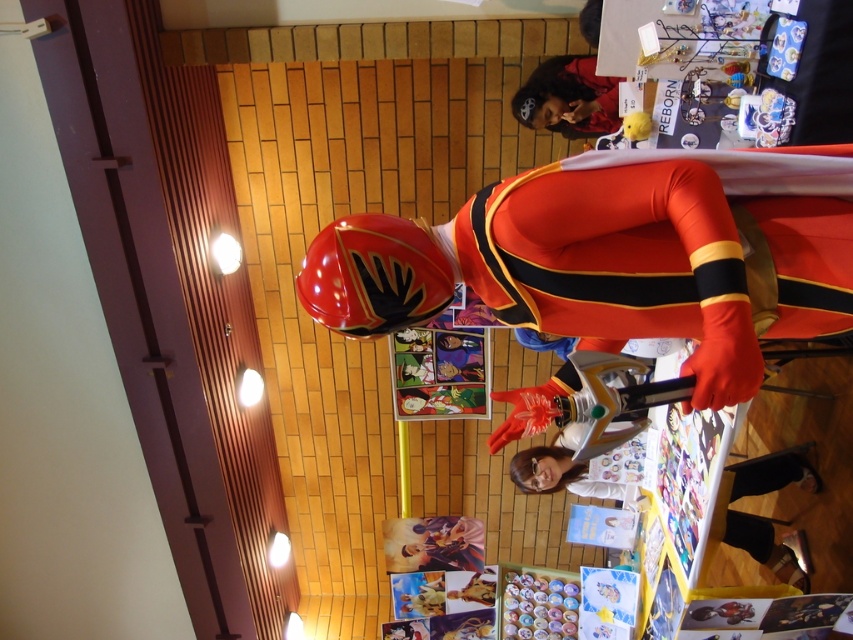
Is point (735, 182) farther from viewer compared to point (556, 102)?

No, it is not.

Which is in front, point (647, 172) or point (564, 97)?

Positioned in front is point (647, 172).

Where is `shiny red helmet at upper center`? This screenshot has height=640, width=853. shiny red helmet at upper center is located at coordinates (618, 257).

Who is higher up, shiny red helmet at upper center or white glossy shirt at lower center?

shiny red helmet at upper center is higher up.

Who is shorter, shiny red helmet at upper center or white glossy shirt at lower center?

white glossy shirt at lower center is shorter.

Between point (544, 227) and point (548, 451), which one is positioned behind?

The point (548, 451) is behind.

Find the location of a particular element. shiny red helmet at upper center is located at coordinates (618, 257).

Between shiny orange spandex at center and white glossy shirt at lower center, which one is positioned higher?

Positioned higher is shiny orange spandex at center.

Can you confirm if shiny orange spandex at center is shorter than white glossy shirt at lower center?

Correct, shiny orange spandex at center is not as tall as white glossy shirt at lower center.

Measure the distance between shiny orange spandex at center and camera.

shiny orange spandex at center is 4.07 feet away from camera.

Identify the location of shiny orange spandex at center. This screenshot has width=853, height=640. (666, 248).